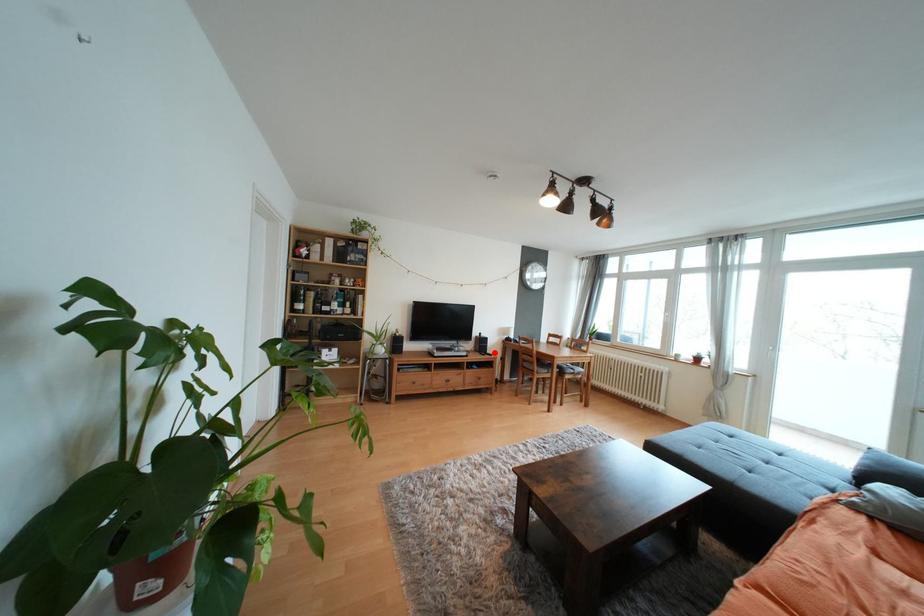
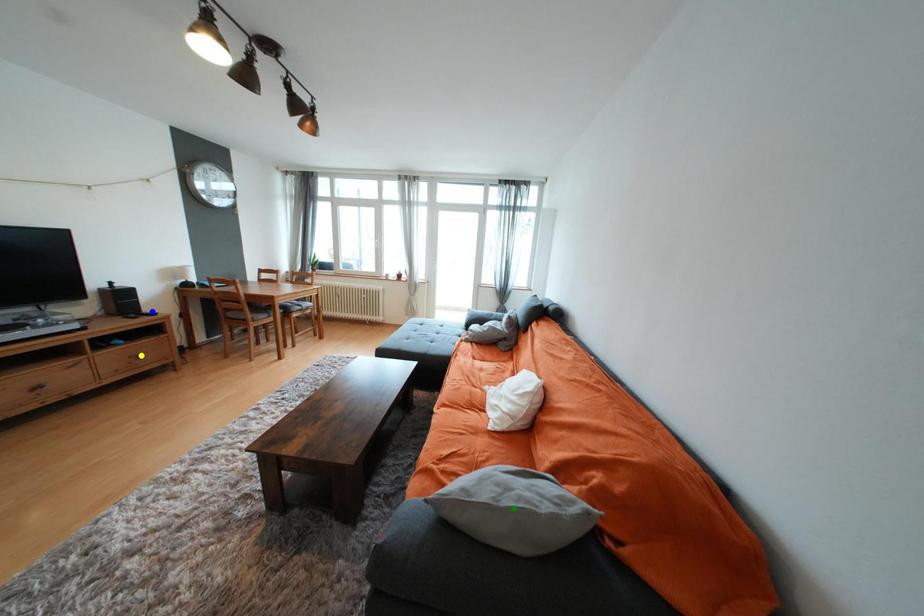
Question: I am providing you with two images of the same scene from different viewpoints. A red point is marked on the first image. You are given multiple points on the second image. Which spot in image 2 lines up with the point in image 1?

Choices:
 (A) green point
 (B) yellow point
 (C) blue point

Answer: (C)